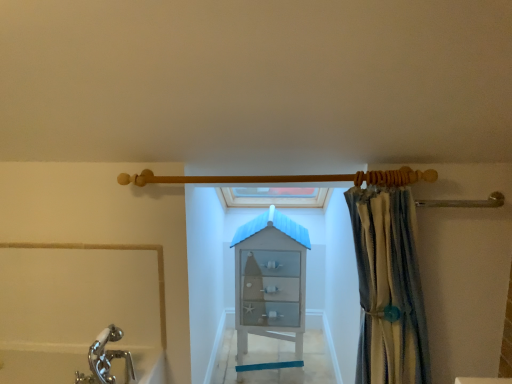
Question: Considering the positions of white glass cabinet at center and wooden shower rod at upper center in the image, is white glass cabinet at center wider or thinner than wooden shower rod at upper center?

Choices:
 (A) thin
 (B) wide

Answer: (B)

Question: Considering the positions of point click(269, 241) and point click(320, 177), is point click(269, 241) closer or farther from the camera than point click(320, 177)?

Choices:
 (A) farther
 (B) closer

Answer: (A)

Question: Based on their relative distances, which object is farther from the striped fabric curtain at right?

Choices:
 (A) white glass cabinet at center
 (B) wooden shower rod at upper center

Answer: (A)

Question: Which is farther from the striped fabric curtain at right?

Choices:
 (A) white glass cabinet at center
 (B) wooden shower rod at upper center

Answer: (A)